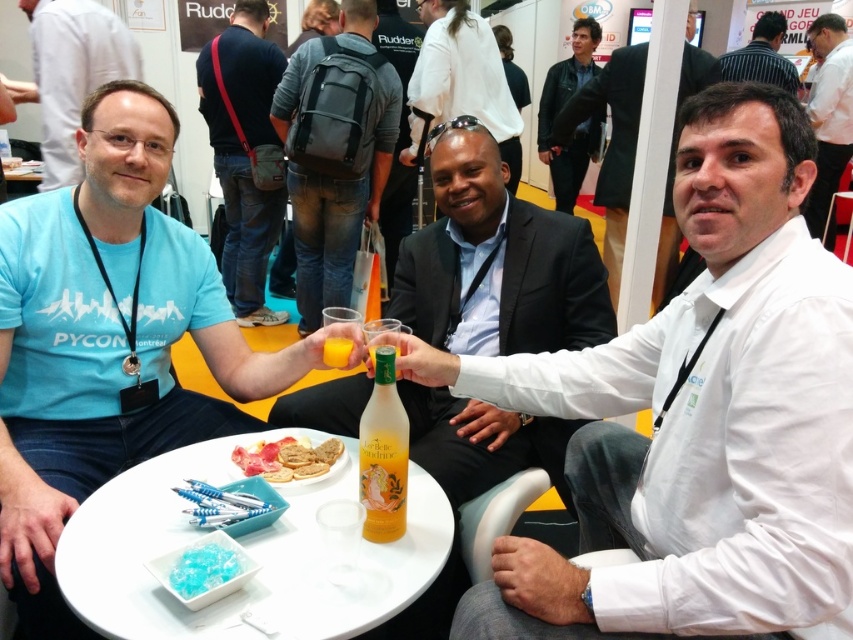
You are organizing a small gathering and need to place a 12 inch diameter cake on the table. Given the sizes of the white plastic table at center and the smooth white plate at center, will the cake fit on the table?

The white plastic table at center is bigger than the smooth white plate at center, so the cake will fit on the white plastic table at center as long as the table is large enough to accommodate the 12 inch diameter cake.

You are a waiter at the event and need to place a new smooth white plate at center on the table. Is the white plastic table at center currently positioned in a way that allows you to place the plate on it?

The white plastic table at center is below smooth white plate at center, so yes, the table is positioned correctly to support the plate.

You are standing at the entrance of the convention center and see two points in the image. One is at point (128, 29) and the other is at point (231, 570). Which point is closer to you?

Point (128, 29) is further to the camera than point (231, 570), so the point at (231, 570) is closer to you.